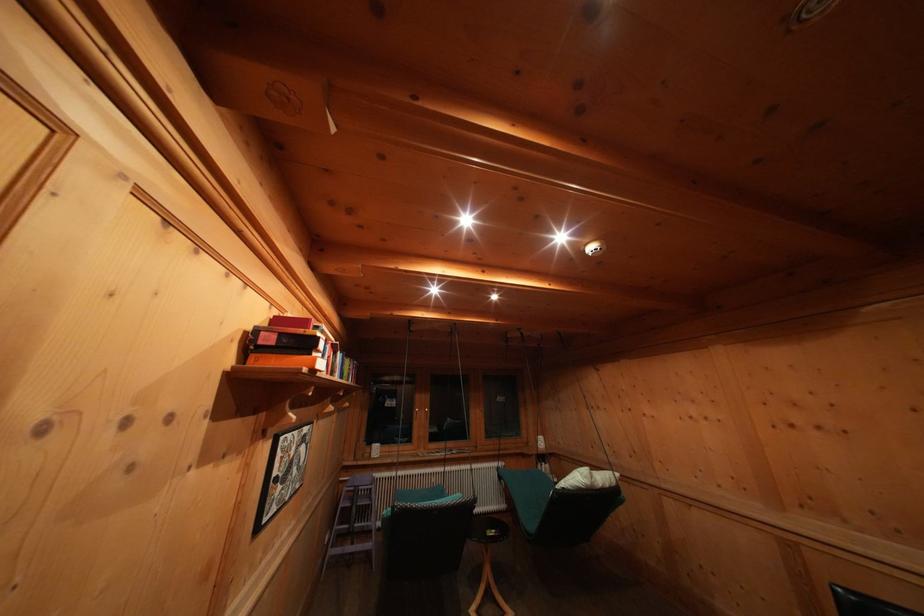
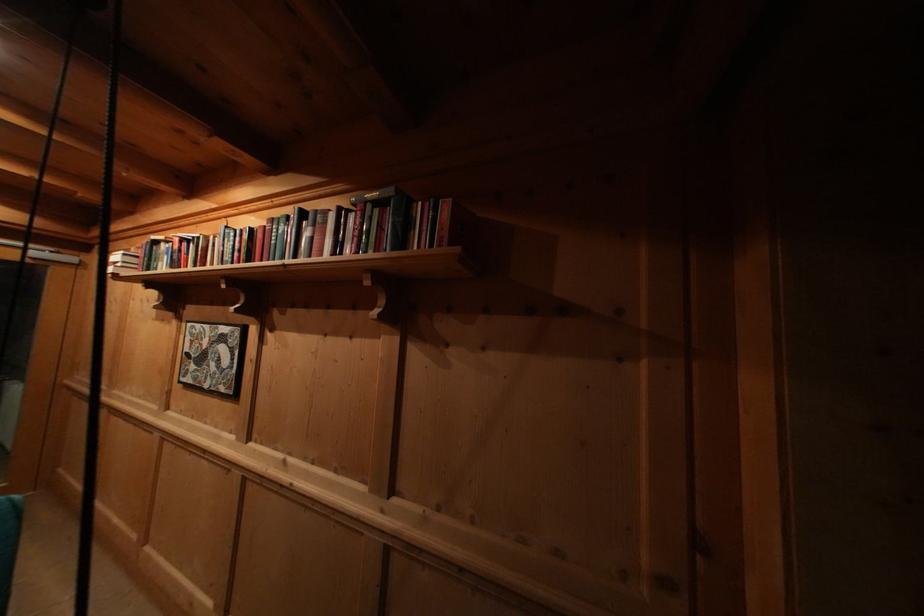
In the second image, find the point that corresponds to point 296,440 in the first image.

(204, 331)